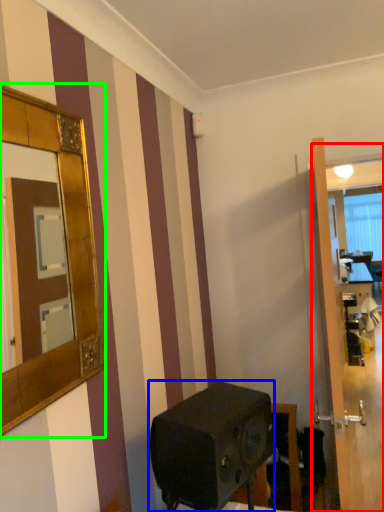
Question: Which object is positioned farthest from glass door (highlighted by a red box)? Select from appliance (highlighted by a blue box) and mirror (highlighted by a green box).

Choices:
 (A) appliance
 (B) mirror

Answer: (B)